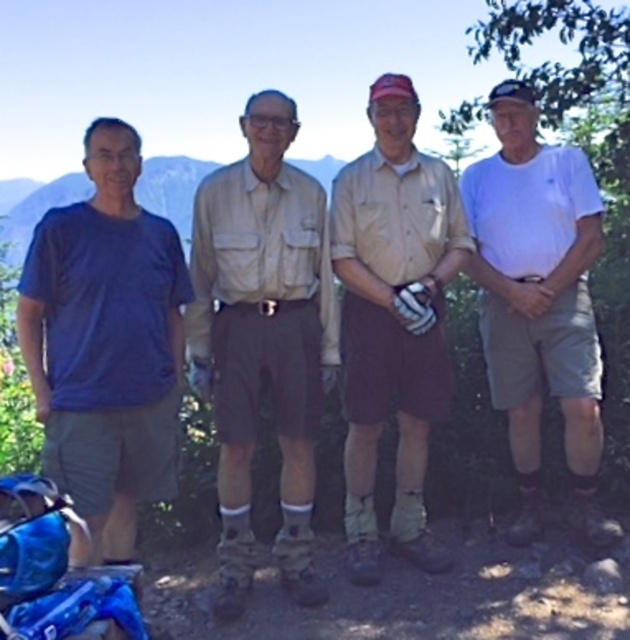
Question: Does blue cotton shirt at left have a lesser width compared to white synthetic baseball glove at center?

Choices:
 (A) yes
 (B) no

Answer: (B)

Question: Among these objects, which one is farthest from the camera?

Choices:
 (A) white cotton shirt at right
 (B) blue cotton shirt at left
 (C) tan/cotton shirt at center
 (D) white synthetic baseball glove at center

Answer: (A)

Question: Does beige fabric shirt at center have a lesser width compared to tan/cotton shirt at center?

Choices:
 (A) yes
 (B) no

Answer: (B)

Question: Where is blue cotton shirt at left located in relation to tan/cotton shirt at center in the image?

Choices:
 (A) below
 (B) above

Answer: (A)

Question: Which of the following is the farthest from the observer?

Choices:
 (A) white cotton shirt at right
 (B) blue cotton shirt at left
 (C) beige fabric shirt at center

Answer: (A)

Question: Which object is the closest to the blue cotton shirt at left?

Choices:
 (A) white cotton shirt at right
 (B) beige fabric shirt at center
 (C) tan/cotton shirt at center

Answer: (B)